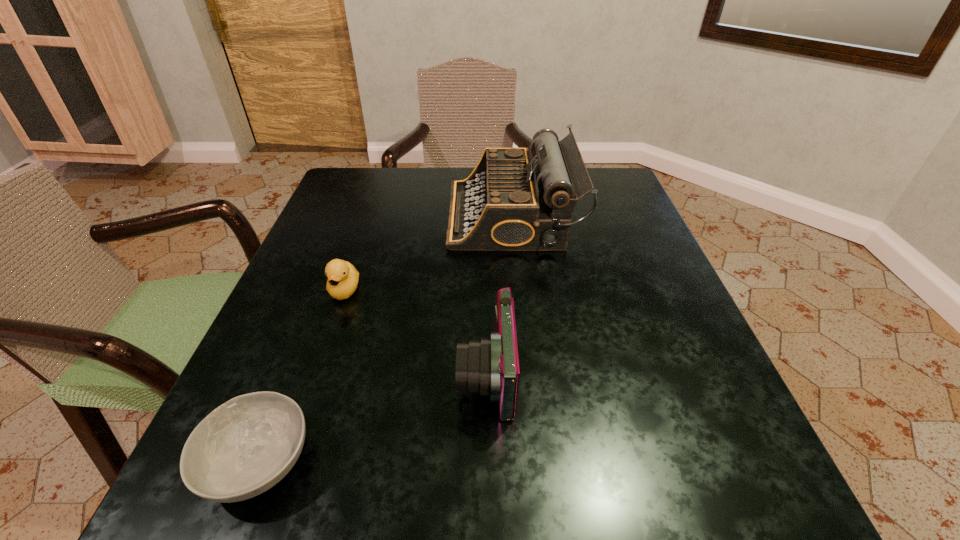
Where is `object that is at the far right corner`? The width and height of the screenshot is (960, 540). object that is at the far right corner is located at coordinates (510, 202).

This screenshot has width=960, height=540. I want to click on free space at the far edge, so (x=441, y=203).

You are a GUI agent. You are given a task and a screenshot of the screen. Output one action in this format:
    pyautogui.click(x=<x>, y=<y>)
    Task: Click on the vacant space at the near edge of the desktop
    The image size is (960, 540).
    Given the screenshot: What is the action you would take?
    pyautogui.click(x=572, y=460)

You are a GUI agent. You are given a task and a screenshot of the screen. Output one action in this format:
    pyautogui.click(x=<x>, y=<y>)
    Task: Click on the free region at the left edge of the desktop
    
    Given the screenshot: What is the action you would take?
    pyautogui.click(x=316, y=253)

This screenshot has height=540, width=960. I want to click on vacant point at the right edge, so click(633, 394).

Where is `vacant space at the far left corner of the desktop`? This screenshot has height=540, width=960. vacant space at the far left corner of the desktop is located at coordinates pos(387,210).

Where is `free spot at the far right corner of the desktop`? The height and width of the screenshot is (540, 960). free spot at the far right corner of the desktop is located at coordinates (607, 190).

Where is `free space that is in between the tallest object and the duckling`? Image resolution: width=960 pixels, height=540 pixels. free space that is in between the tallest object and the duckling is located at coordinates (428, 253).

Locate an element on the screen. Image resolution: width=960 pixels, height=540 pixels. empty space between the second farthest object and the bowl is located at coordinates (301, 376).

In order to click on free space between the camera and the duckling in this screenshot , I will do `click(416, 332)`.